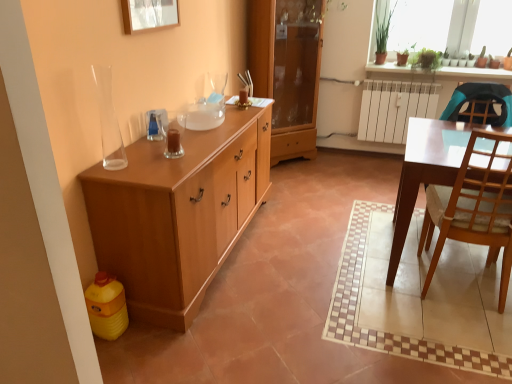
Locate an element on the screen. This screenshot has width=512, height=384. vacant region in front of light brown wooden chair at right is located at coordinates (452, 335).